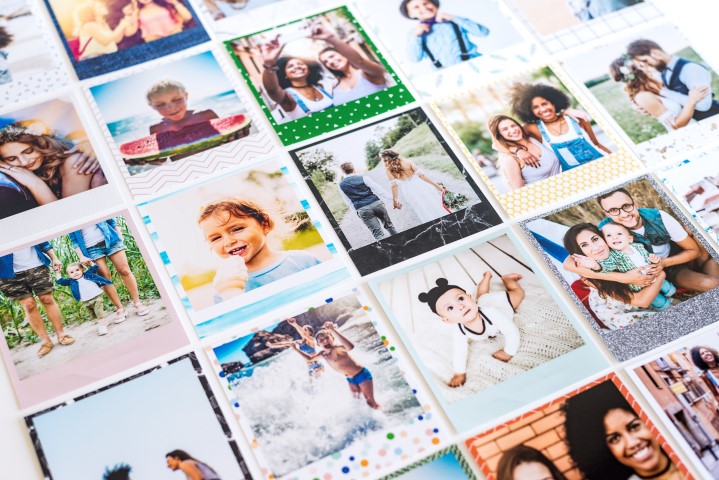
Locate an element on the screen. The width and height of the screenshot is (719, 480). photographs on the third row is located at coordinates (96, 282), (234, 277), (384, 191), (546, 124), (679, 69).